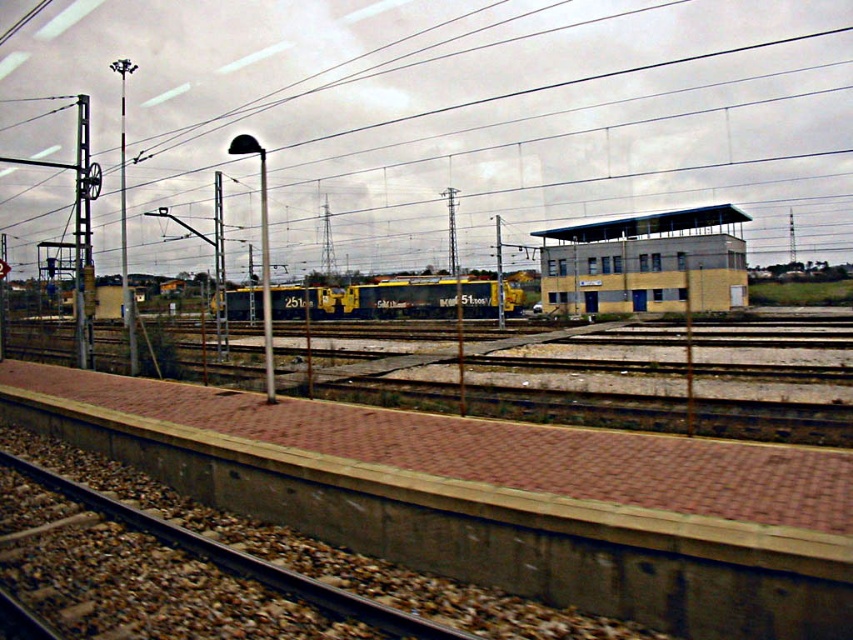
Can you confirm if brown gravel train track at lower left is shorter than metallic pole at center?

Indeed, brown gravel train track at lower left has a lesser height compared to metallic pole at center.

Does brown gravel train track at lower left appear on the right side of metallic pole at center?

Indeed, brown gravel train track at lower left is positioned on the right side of metallic pole at center.

Locate an element on the screen. The width and height of the screenshot is (853, 640). brown gravel train track at lower left is located at coordinates (241, 560).

Where is `brown gravel train track at lower left`? brown gravel train track at lower left is located at coordinates (241, 560).

Is point (680, 221) farther from camera compared to point (164, 531)?

Yes, it is.

Locate an element on the screen. yellow concrete building at center is located at coordinates (646, 262).

I want to click on yellow concrete building at center, so click(646, 262).

Is brown gravel train track at lower left to the left of yellow painted metal freight train at center from the viewer's perspective?

In fact, brown gravel train track at lower left is to the right of yellow painted metal freight train at center.

Can you confirm if brown gravel train track at lower left is positioned above yellow painted metal freight train at center?

Actually, brown gravel train track at lower left is below yellow painted metal freight train at center.

This screenshot has height=640, width=853. Describe the element at coordinates (241, 560) in the screenshot. I see `brown gravel train track at lower left` at that location.

The width and height of the screenshot is (853, 640). In order to click on brown gravel train track at lower left in this screenshot , I will do `click(241, 560)`.